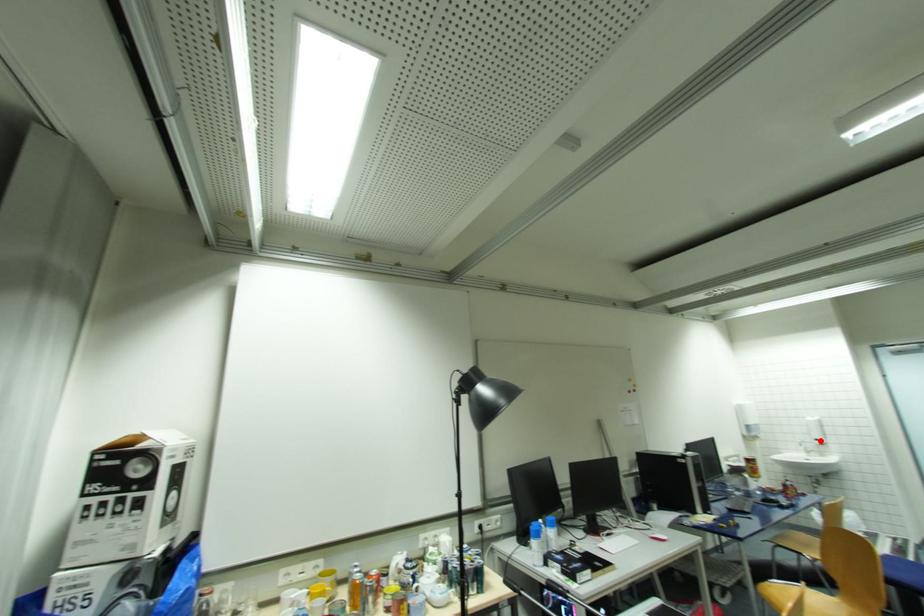
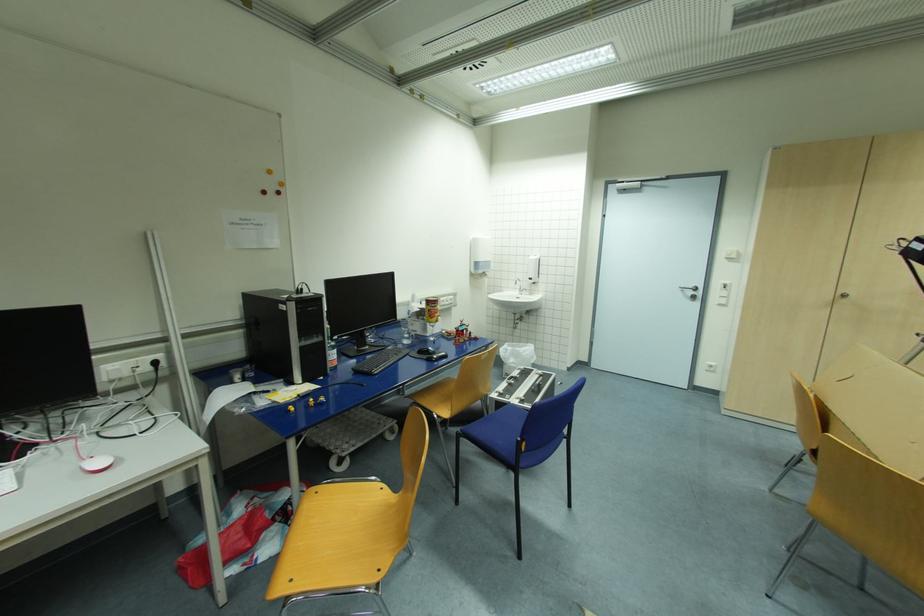
Question: I am providing you with two images of the same scene from different viewpoints. A red point is shown in image1. For the corresponding object point in image2, is it positioned nearer or farther from the camera?

Choices:
 (A) Nearer
 (B) Farther

Answer: (B)